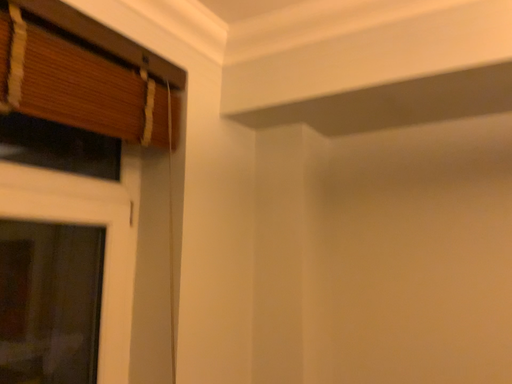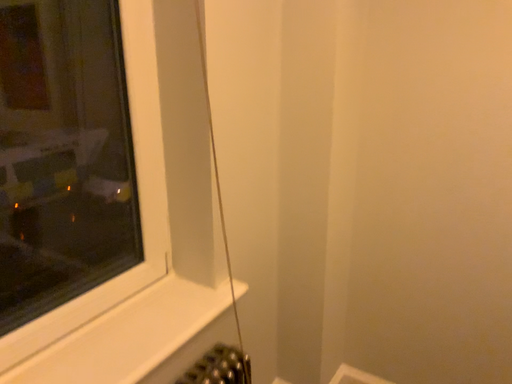
Question: Which way did the camera rotate in the video?

Choices:
 (A) rotated upward
 (B) rotated downward

Answer: (B)